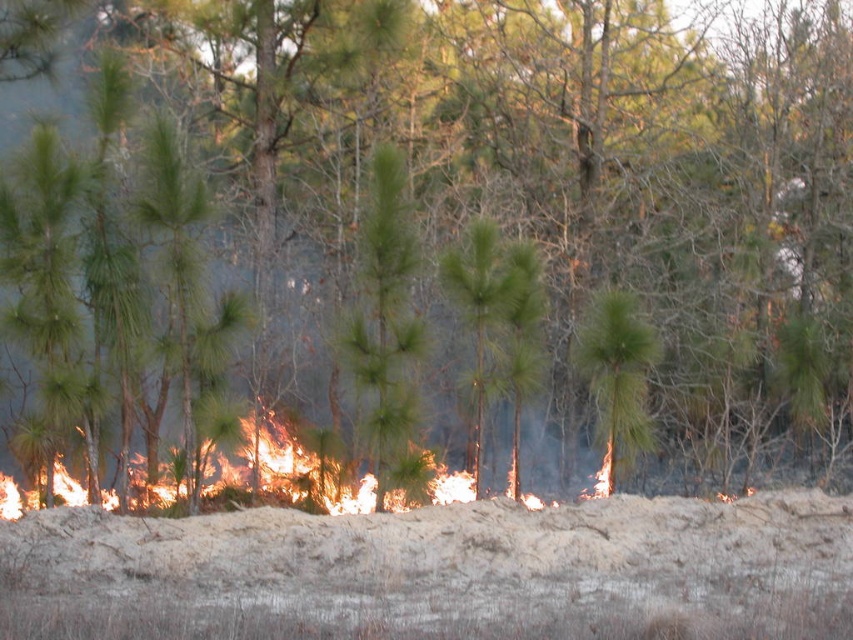
Question: Can you confirm if green needle-like at center is positioned above flaming flames at center?

Choices:
 (A) no
 (B) yes

Answer: (B)

Question: Which point is closer to the camera?

Choices:
 (A) flaming flames at center
 (B) green needle-like at center

Answer: (B)

Question: Among these points, which one is nearest to the camera?

Choices:
 (A) (270, 444)
 (B) (412, 349)

Answer: (B)

Question: Is green needle-like at center wider than flaming flames at center?

Choices:
 (A) yes
 (B) no

Answer: (B)

Question: Is green needle-like at center bigger than flaming flames at center?

Choices:
 (A) yes
 (B) no

Answer: (A)

Question: Which point appears closest to the camera in this image?

Choices:
 (A) (386, 212)
 (B) (444, 488)

Answer: (A)